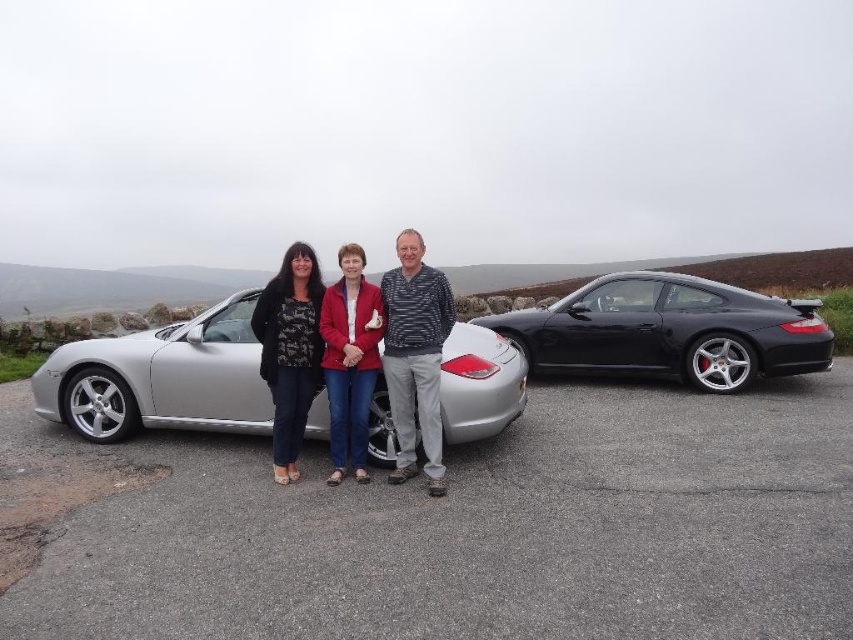
Question: Observing the image, what is the correct spatial positioning of black metallic car at right in reference to matte red jacket at center?

Choices:
 (A) right
 (B) left

Answer: (A)

Question: Does black metallic car at right have a larger size compared to matte black car at center?

Choices:
 (A) yes
 (B) no

Answer: (A)

Question: Which point is closer to the camera taking this photo?

Choices:
 (A) (199, 356)
 (B) (372, 344)

Answer: (B)

Question: Which of the following is the closest to the observer?

Choices:
 (A) [x=393, y=426]
 (B) [x=380, y=381]
 (C) [x=341, y=321]
 (D) [x=724, y=355]

Answer: (A)

Question: Which object is positioned farthest from the silver metallic car at center?

Choices:
 (A) matte black car at center
 (B) black metallic car at right

Answer: (B)

Question: Can you confirm if silver metallic car at center is positioned to the right of matte black car at center?

Choices:
 (A) no
 (B) yes

Answer: (A)